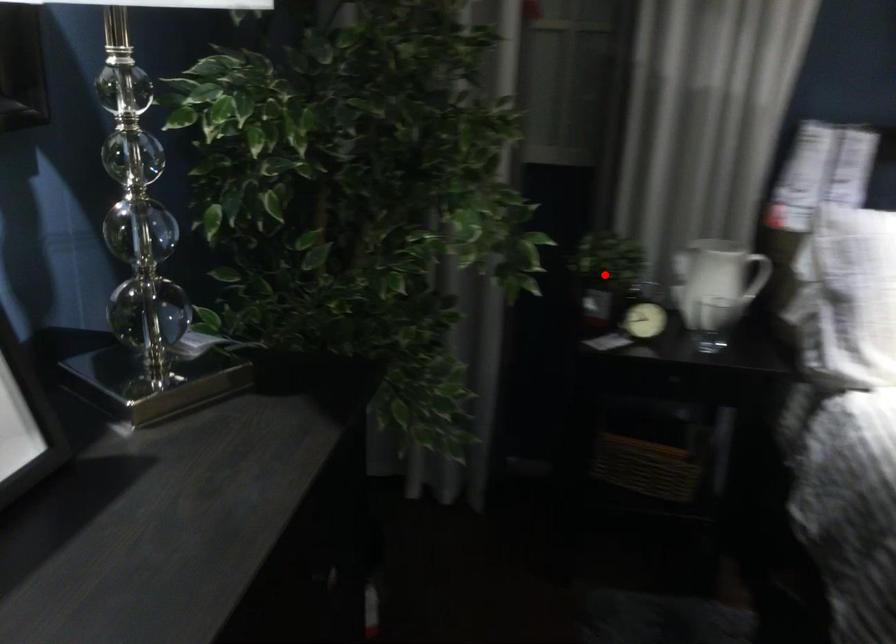
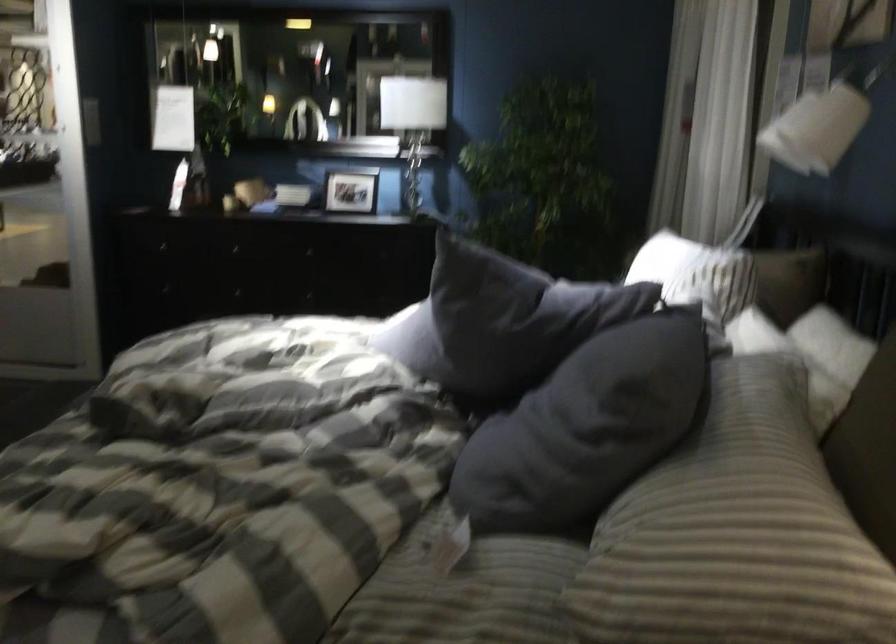
Question: I am providing you with two images of the same scene from different viewpoints. A red point is marked on the first image. Can you still see the location of the red point in image 2?

Choices:
 (A) Yes
 (B) No

Answer: (B)